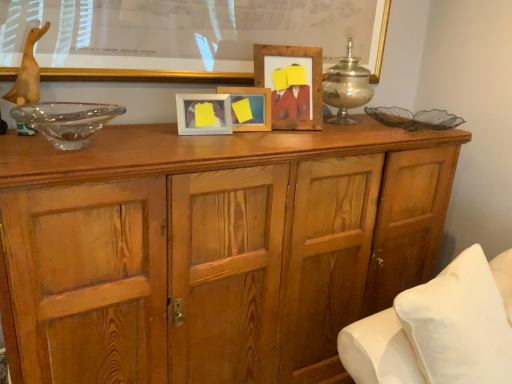
I want to click on free space between matte wooden picture frame at center, acting as the first picture frame starting from the left, and transparent glass bowl at left, so click(156, 132).